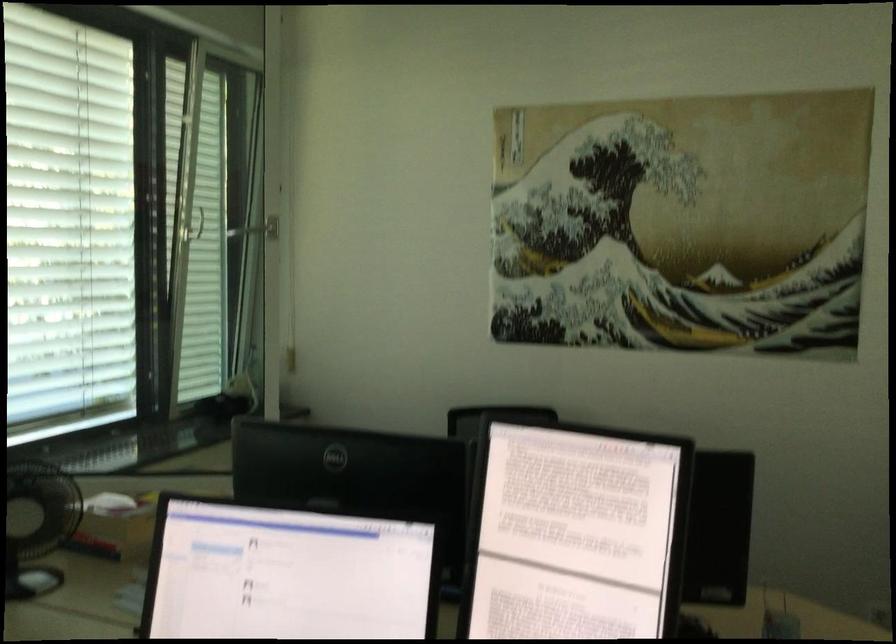
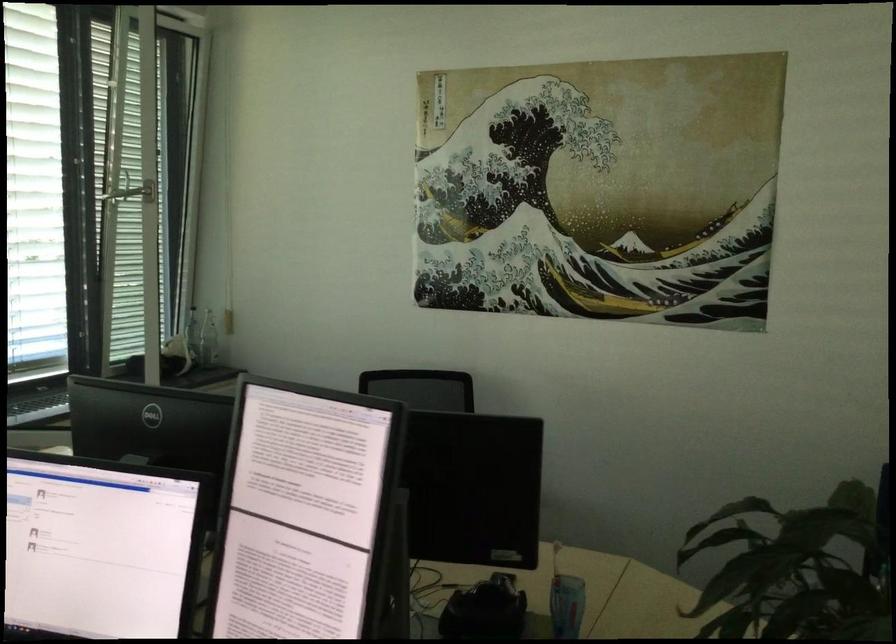
Where in the second image is the point corresponding to (240,366) from the first image?

(192, 334)